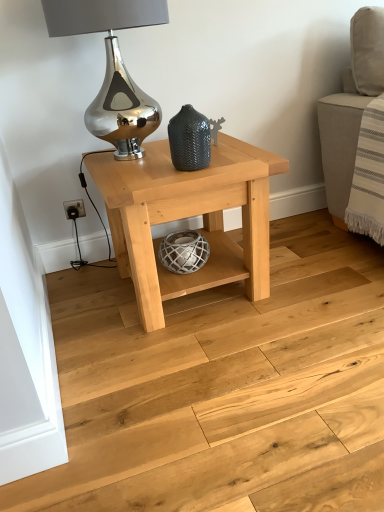
Identify the location of free point to the right of natural wood table at center. The image size is (384, 512). (317, 276).